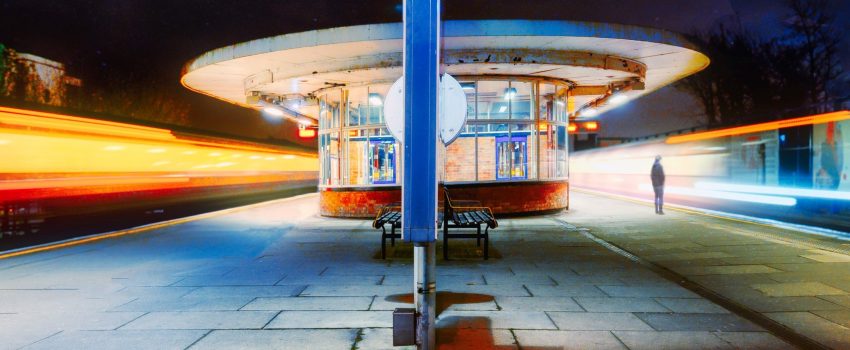
Find the location of a particular element. The width and height of the screenshot is (850, 350). lower windows is located at coordinates (540, 159), (513, 162), (466, 161), (383, 166), (346, 169), (335, 173).